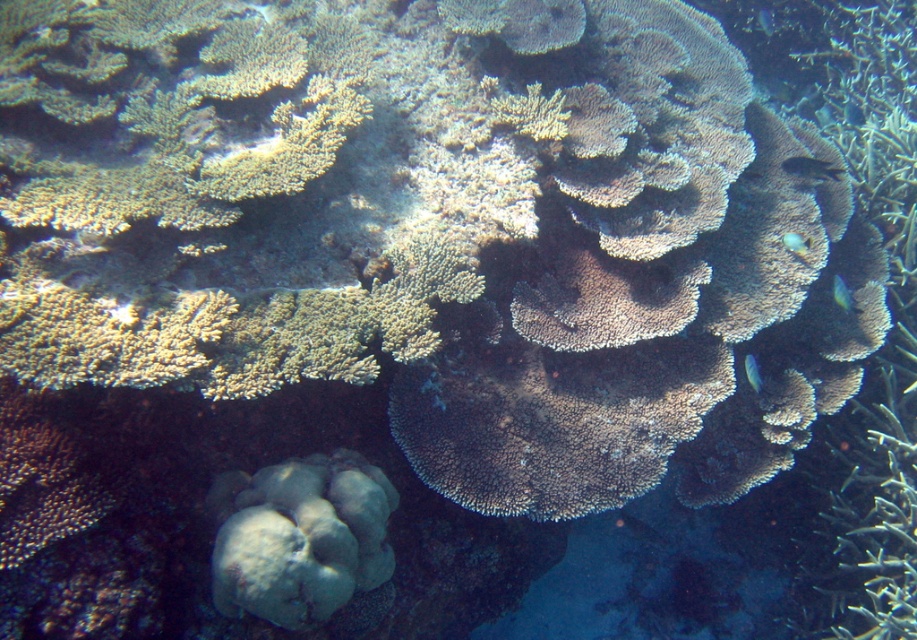
Who is positioned more to the right, blue glossy fish at right or blue glossy fish at lower right?

Positioned to the right is blue glossy fish at right.

Can you confirm if blue glossy fish at right is bigger than blue glossy fish at lower right?

No, blue glossy fish at right is not bigger than blue glossy fish at lower right.

The image size is (917, 640). I want to click on blue glossy fish at right, so click(794, 243).

Locate an element on the screen. Image resolution: width=917 pixels, height=640 pixels. blue glossy fish at right is located at coordinates (794, 243).

Who is positioned more to the right, shiny black fish at center or translucent blue fish at upper center?

Positioned to the right is translucent blue fish at upper center.

Who is shorter, shiny black fish at center or translucent blue fish at upper center?

shiny black fish at center

At what (x,y) coordinates should I click in order to perform the action: click on shiny black fish at center. Please return your answer as a coordinate pair (x, y). The height and width of the screenshot is (640, 917). Looking at the image, I should click on (811, 168).

Is point (783, 163) farther from viewer compared to point (749, 365)?

Yes, it is behind point (749, 365).

Identify the location of shiny black fish at center. The height and width of the screenshot is (640, 917). (811, 168).

Which is behind, point (835, 173) or point (755, 365)?

Positioned behind is point (835, 173).

Identify the location of shiny black fish at center. The height and width of the screenshot is (640, 917). (811, 168).